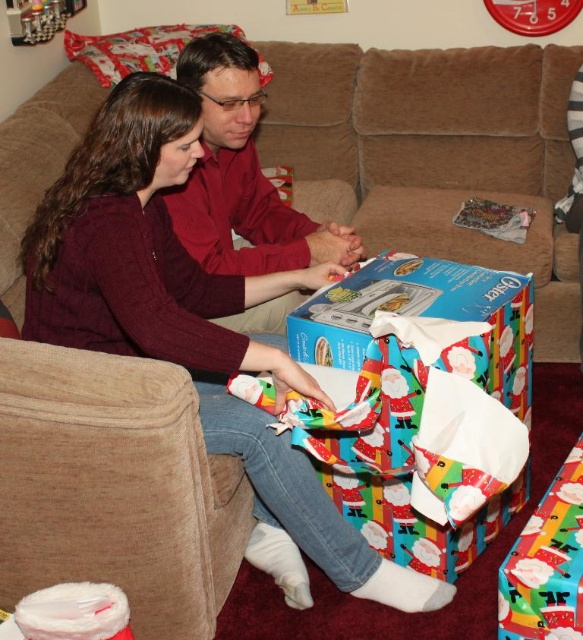
Looking at this image, does matte maroon sweater at center have a lesser width compared to matte red shirt at center?

In fact, matte maroon sweater at center might be wider than matte red shirt at center.

Between matte maroon sweater at center and matte red shirt at center, which one appears on the left side from the viewer's perspective?

matte red shirt at center

Who is more forward, (x=290, y=500) or (x=272, y=236)?

Point (x=290, y=500) is more forward.

Image resolution: width=583 pixels, height=640 pixels. Identify the location of matte maroon sweater at center. (191, 328).

Can you confirm if brown fabric couch at center is positioned to the left of matte red shirt at center?

No, brown fabric couch at center is not to the left of matte red shirt at center.

Does brown fabric couch at center have a lesser height compared to matte red shirt at center?

In fact, brown fabric couch at center may be taller than matte red shirt at center.

Between point (552, 225) and point (233, 104), which one is positioned behind?

Point (552, 225)

The image size is (583, 640). What are the coordinates of `brown fabric couch at center` in the screenshot? It's located at (433, 154).

Can you confirm if brown fabric couch at center is positioned below matte maroon sweater at center?

No, brown fabric couch at center is not below matte maroon sweater at center.

Who is taller, brown fabric couch at center or matte maroon sweater at center?

brown fabric couch at center is taller.

Is point (427, 124) behind point (303, 481)?

Yes, it is behind point (303, 481).

Where is `brown fabric couch at center`? The width and height of the screenshot is (583, 640). brown fabric couch at center is located at coordinates (433, 154).